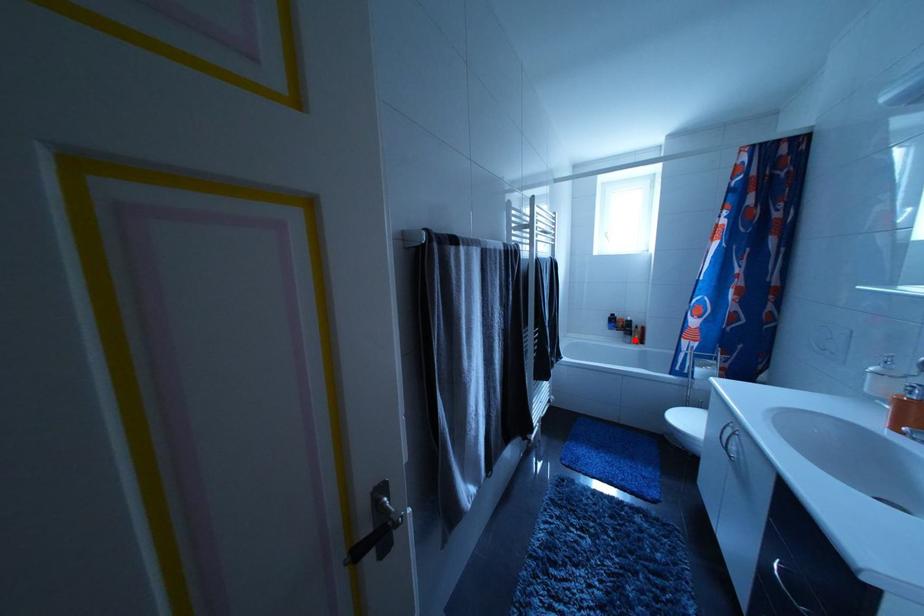
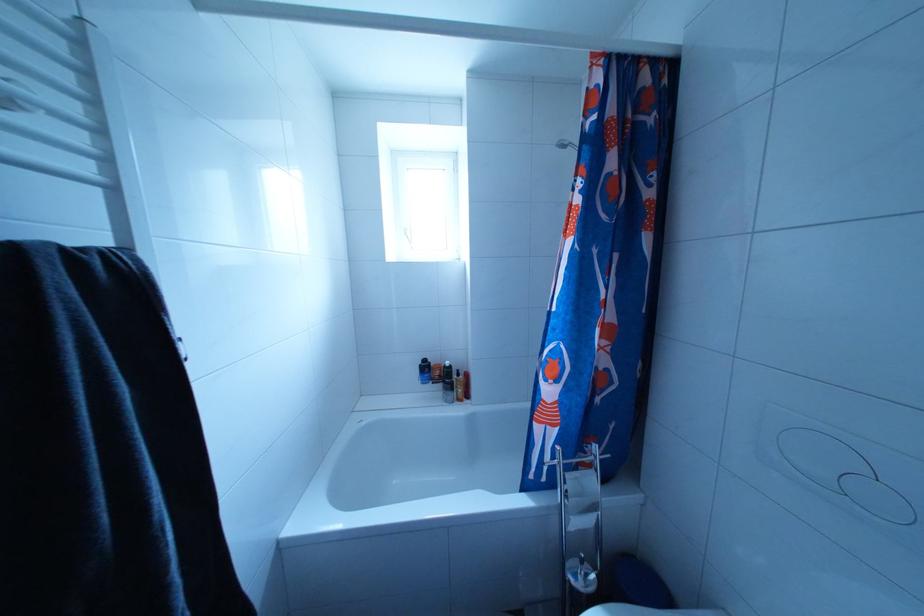
Where in the second image is the point corresponding to the highlighted location from the first image?

(455, 395)